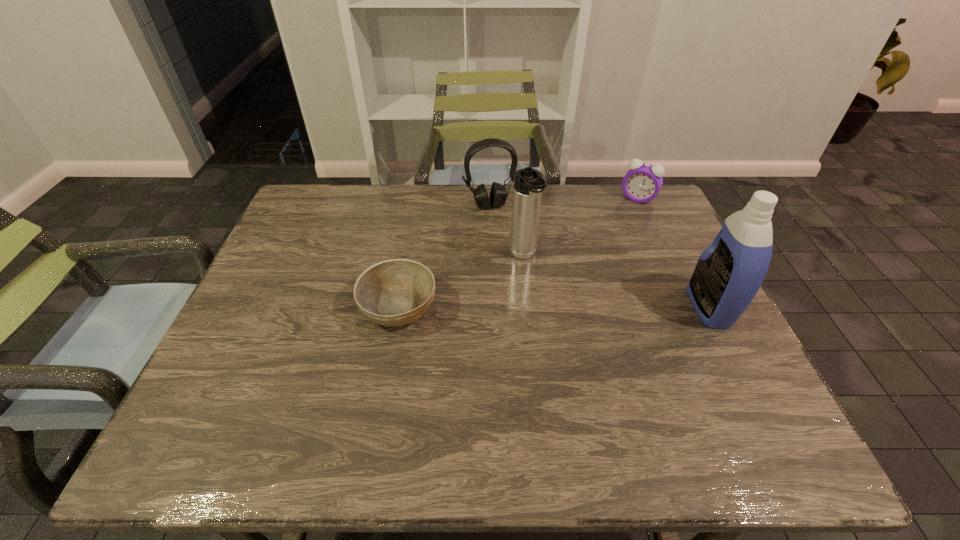
At what (x,y) coordinates should I click in order to perform the action: click on the leftmost object. Please return your answer as a coordinate pair (x, y). The image size is (960, 540). Looking at the image, I should click on (394, 293).

Where is `bowl`? bowl is located at coordinates (394, 293).

You are a GUI agent. You are given a task and a screenshot of the screen. Output one action in this format:
    pyautogui.click(x=<x>, y=<y>)
    Task: Click on the detergent
    The height and width of the screenshot is (540, 960).
    Given the screenshot: What is the action you would take?
    pyautogui.click(x=728, y=274)

Find the location of a particular element. The image size is (960, 540). the second shortest object is located at coordinates (643, 181).

The height and width of the screenshot is (540, 960). I want to click on the third shortest object, so click(498, 194).

Locate an element on the screen. The height and width of the screenshot is (540, 960). the fourth shortest object is located at coordinates (528, 185).

Identify the location of the third nearest object. (528, 185).

You are a GUI agent. You are given a task and a screenshot of the screen. Output one action in this format:
    pyautogui.click(x=<x>, y=<y>)
    Task: Click on the vacant region located 0.360m on the right of the shortest object
    
    Given the screenshot: What is the action you would take?
    pyautogui.click(x=582, y=307)

What are the coordinates of `free location located on the left of the detergent` in the screenshot? It's located at tap(667, 307).

This screenshot has height=540, width=960. Find the location of `free space located 0.380m on the face of the second shortest object`. free space located 0.380m on the face of the second shortest object is located at coordinates [590, 278].